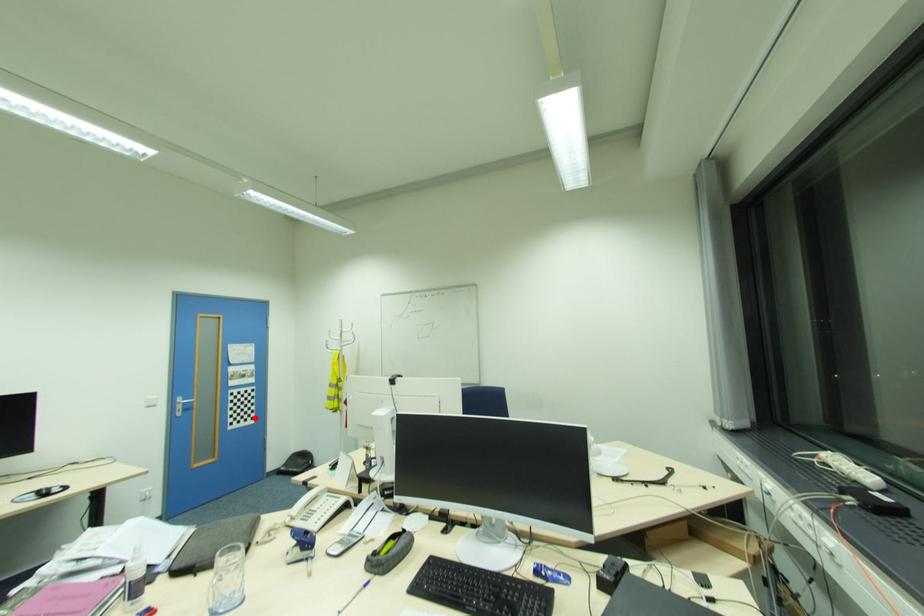
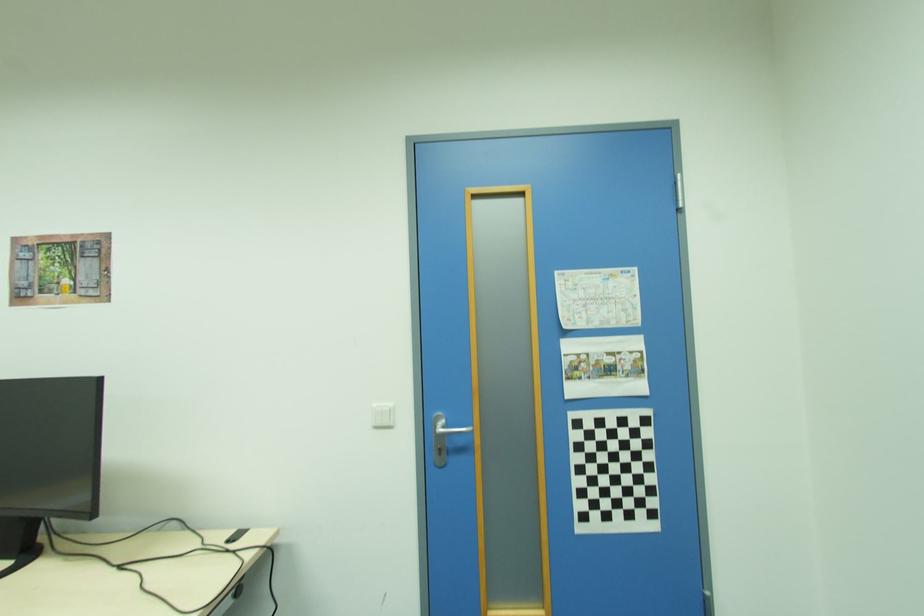
Locate, in the second image, the point that corresponds to the highlighted location in the first image.

(655, 515)